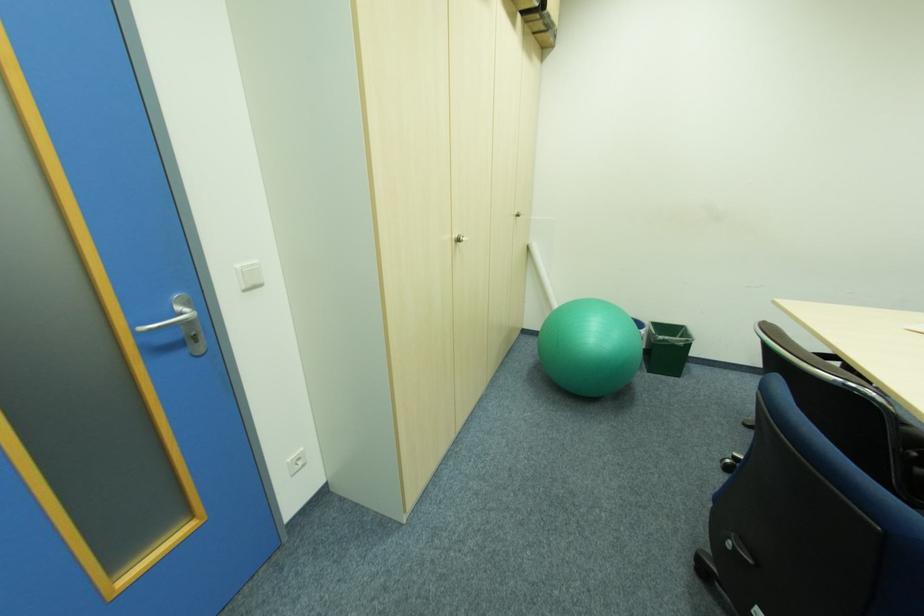
Where is `chair armrest`? chair armrest is located at coordinates (909, 435).